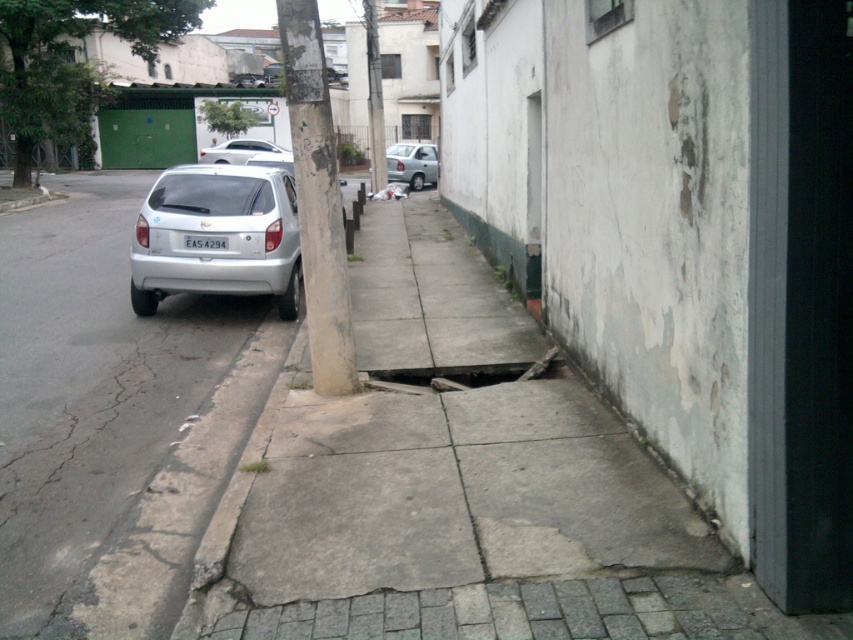
You are a delivery person trying to navigate a narrow sidewalk with a cart. There is a concrete pole at center. Can you pass around the pole without going into the road?

The concrete pole at center is located at point (317,198), which indicates its position on the sidewalk. Since the sidewalk has a noticeable gap or hole near the center and uneven surface, it might be challenging to navigate around the pole safely without encountering the uneven terrain. However, the exact feasibility depends on the cart size and the space available around the pole. The description does not provide specific measurements about the pole width or the available space, so it is recommended to

You are a delivery person carrying a heavy box and need to cross the sidewalk. You notice the rusty metal hole at center and the white plastic license plate at center. Which one should you avoid stepping on to prevent falling into the hole?

You should avoid stepping on the rusty metal hole at center because it has a larger size compared to the white plastic license plate at center, making it a potential hazard for tripping or falling.

You are a delivery person holding a package and need to place it on the sidewalk. There is a concrete pole at center and a white matte car at center nearby. Which object is blocking your path to the sidewalk?

The concrete pole at center is positioned under the white matte car at center, so the car is blocking the path to the sidewalk.